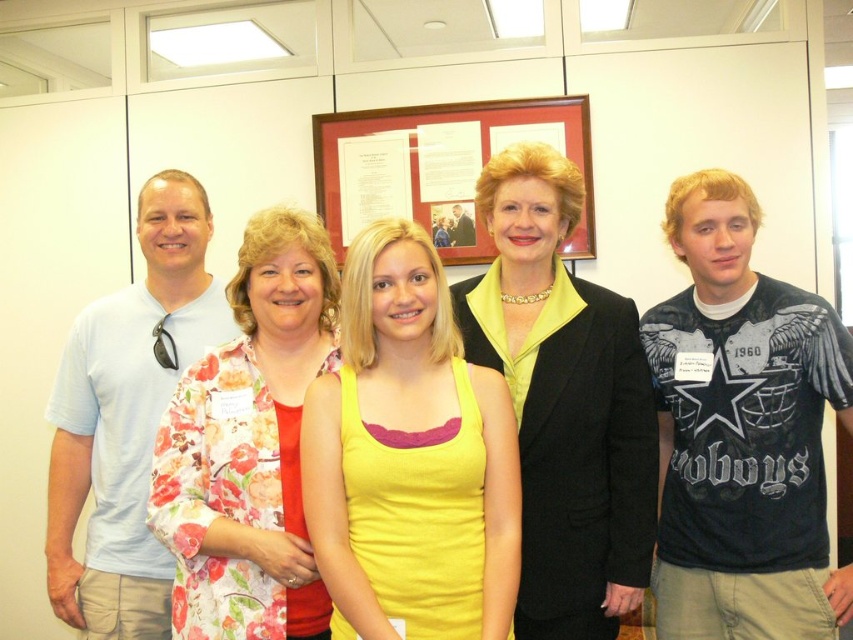
Does white paper at center have a greater height compared to white paper at upper center?

Correct, white paper at center is much taller as white paper at upper center.

Who is shorter, white paper at center or white paper at upper center?

white paper at upper center

Is point (357, 176) positioned in front of point (436, 138)?

No, it is not.

Where is `white paper at center`? white paper at center is located at coordinates (372, 179).

Measure the distance between light blue t-shirt at left and white paper at upper center.

light blue t-shirt at left is 1.26 meters from white paper at upper center.

What do you see at coordinates (126, 417) in the screenshot? The image size is (853, 640). I see `light blue t-shirt at left` at bounding box center [126, 417].

The width and height of the screenshot is (853, 640). Find the location of `light blue t-shirt at left`. light blue t-shirt at left is located at coordinates [x=126, y=417].

Can you confirm if wooden framed document at upper center is bigger than white paper at center?

Correct, wooden framed document at upper center is larger in size than white paper at center.

Which is above, wooden framed document at upper center or white paper at center?

Positioned higher is wooden framed document at upper center.

Who is more distant from viewer, (360, 124) or (357, 173)?

The point (357, 173) is behind.

This screenshot has width=853, height=640. What are the coordinates of `wooden framed document at upper center` in the screenshot? It's located at (438, 164).